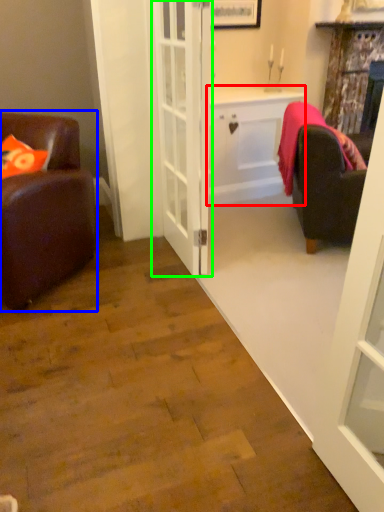
Question: Which object is positioned farthest from cabinetry (highlighted by a red box)? Select from chair (highlighted by a blue box) and door (highlighted by a green box).

Choices:
 (A) chair
 (B) door

Answer: (A)